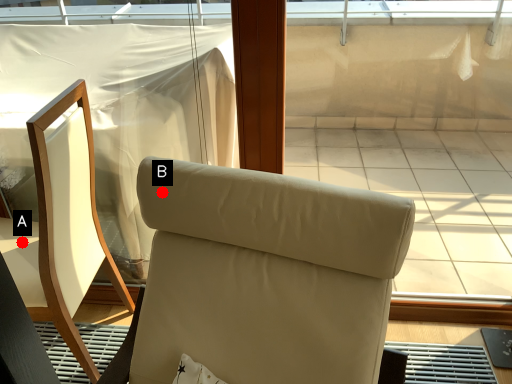
Question: Two points are circled on the image, labeled by A and B beside each circle. Which point appears closest to the camera in this image?

Choices:
 (A) A is closer
 (B) B is closer

Answer: (B)